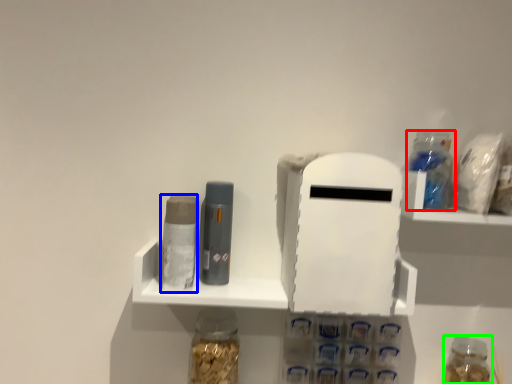
Question: Based on their relative distances, which object is farther from bottle (highlighted by a red box)? Choose from toiletry (highlighted by a blue box) and bottle (highlighted by a green box).

Choices:
 (A) toiletry
 (B) bottle

Answer: (A)